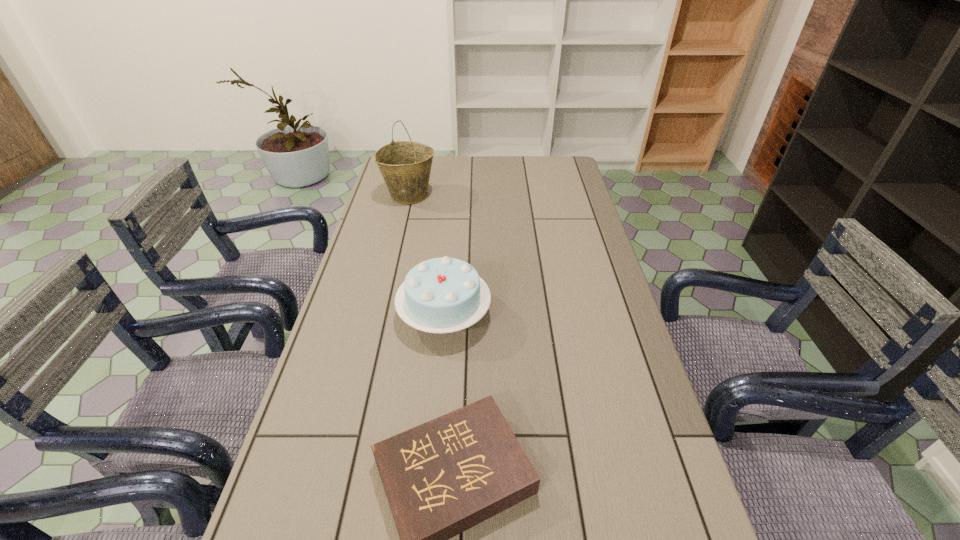
The image size is (960, 540). Find the location of `free space at the left edge`. free space at the left edge is located at coordinates (351, 318).

You are a GUI agent. You are given a task and a screenshot of the screen. Output one action in this format:
    pyautogui.click(x=<x>, y=<y>)
    Task: Click on the free space at the right edge
    
    Given the screenshot: What is the action you would take?
    pyautogui.click(x=601, y=348)

Where is `free space at the far right corner`? free space at the far right corner is located at coordinates (553, 163).

Locate an element on the screen. empty space that is in between the tallest object and the second tallest object is located at coordinates (427, 255).

At what (x,y) coordinates should I click in order to perform the action: click on free space between the second tallest object and the wine bucket. Please return your answer as a coordinate pair (x, y). This screenshot has width=960, height=540. Looking at the image, I should click on click(x=427, y=255).

The image size is (960, 540). Identify the location of unoccupied position between the tallest object and the birthday cake. (427, 255).

What are the coordinates of `object that is the second closest one to the second nearest object` in the screenshot? It's located at (405, 166).

Select which object appears as the closest to the nearest object. Please provide its 2D coordinates. Your answer should be formatted as a tuple, i.e. [(x, y)], where the tuple contains the x and y coordinates of a point satisfying the conditions above.

[(441, 295)]

Where is `free point that satisfies the following two spatial constraints: 1. on the front side of the second farthest object; 2. on the left side of the tallest object`? free point that satisfies the following two spatial constraints: 1. on the front side of the second farthest object; 2. on the left side of the tallest object is located at coordinates (381, 314).